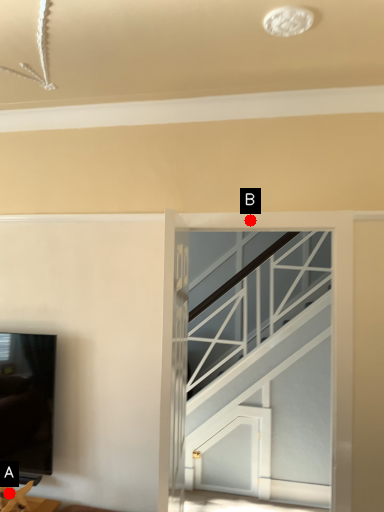
Question: Two points are circled on the image, labeled by A and B beside each circle. Which point is closer to the camera taking this photo?

Choices:
 (A) A is closer
 (B) B is closer

Answer: (A)